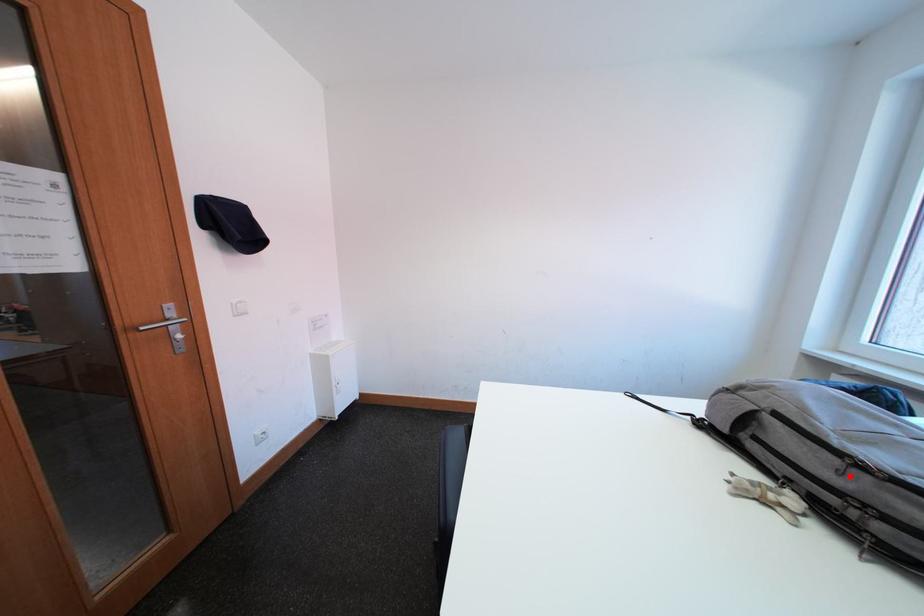
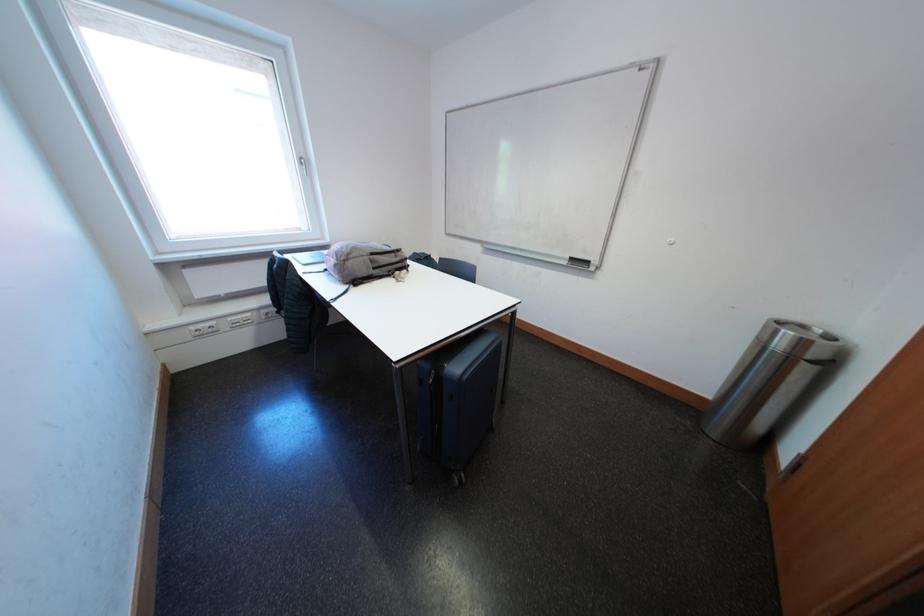
Find the pixel in the second image that matches the highlighted location in the first image.

(406, 261)